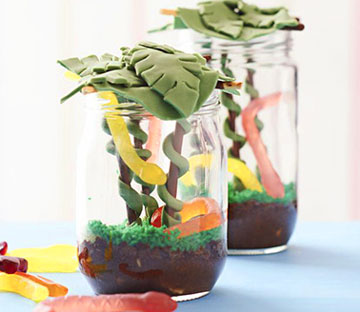
Locate an element on the screen. fake plant leaves is located at coordinates (142, 96), (97, 65), (208, 76), (220, 20), (200, 23), (254, 13).